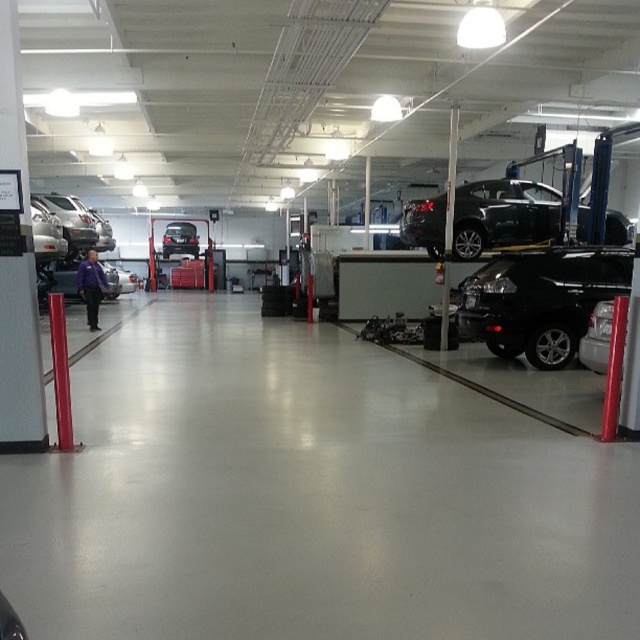
Question: Which point is closer to the camera taking this photo?

Choices:
 (A) (518, 205)
 (B) (172, 225)

Answer: (A)

Question: Which point appears farthest from the camera in this image?

Choices:
 (A) (109, 282)
 (B) (198, 246)

Answer: (B)

Question: Can you confirm if black glossy car at right is positioned to the left of shiny silver car at center?

Choices:
 (A) yes
 (B) no

Answer: (B)

Question: Which point is closer to the camera?

Choices:
 (A) matte black car at left
 (B) black glossy car at right
 (C) glossy black car at center

Answer: (B)

Question: Does glossy black car at center appear over shiny silver car at center?

Choices:
 (A) no
 (B) yes

Answer: (A)

Question: Can you confirm if glossy black car at center is smaller than matte black car at left?

Choices:
 (A) no
 (B) yes

Answer: (B)